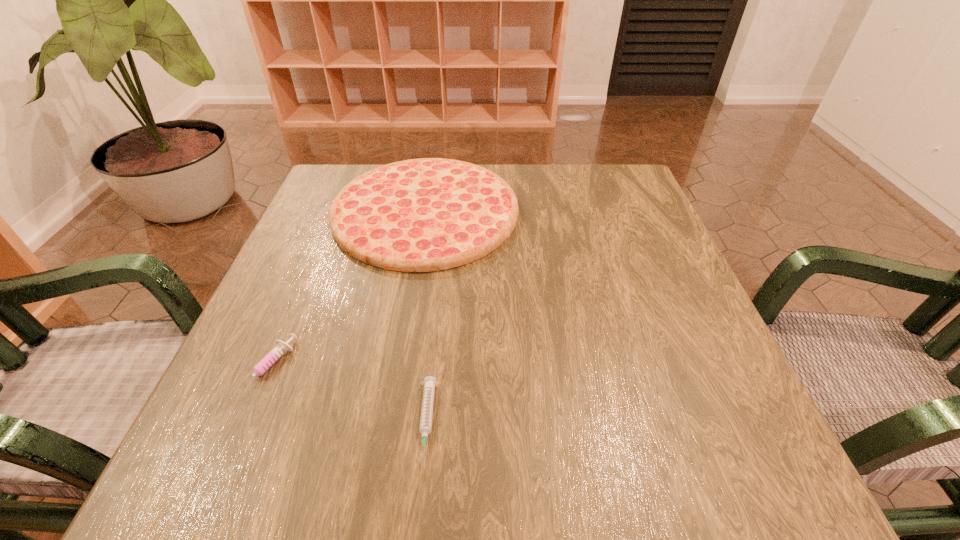
Find the location of a particular element. The height and width of the screenshot is (540, 960). vacant space in between the tallest object and the right syringe is located at coordinates (426, 316).

At what (x,y) coordinates should I click in order to perform the action: click on free spot between the left syringe and the tallest object. Please return your answer as a coordinate pair (x, y). The width and height of the screenshot is (960, 540). Looking at the image, I should click on (347, 290).

In order to click on free space between the left syringe and the tallest object in this screenshot , I will do `click(347, 290)`.

Locate an element on the screen. vacant point located between the tallest object and the right syringe is located at coordinates [x=426, y=316].

Where is `unoccupied position between the left syringe and the right syringe`? Image resolution: width=960 pixels, height=540 pixels. unoccupied position between the left syringe and the right syringe is located at coordinates (348, 395).

Where is `vacant space that is in between the farthest object and the left syringe`? The height and width of the screenshot is (540, 960). vacant space that is in between the farthest object and the left syringe is located at coordinates (347, 290).

Where is `free space between the left syringe and the tallest object`? free space between the left syringe and the tallest object is located at coordinates (347, 290).

Locate an element on the screen. object that stands as the closest to the farthest object is located at coordinates coord(281,348).

You are a GUI agent. You are given a task and a screenshot of the screen. Output one action in this format:
    pyautogui.click(x=<x>, y=<y>)
    Task: Click on the object that stands as the closest to the left syringe
    The width and height of the screenshot is (960, 540).
    Given the screenshot: What is the action you would take?
    pyautogui.click(x=419, y=215)

The height and width of the screenshot is (540, 960). Identify the location of vacant region that satisfies the following two spatial constraints: 1. on the back side of the farthest object; 2. on the left side of the left syringe. (335, 211).